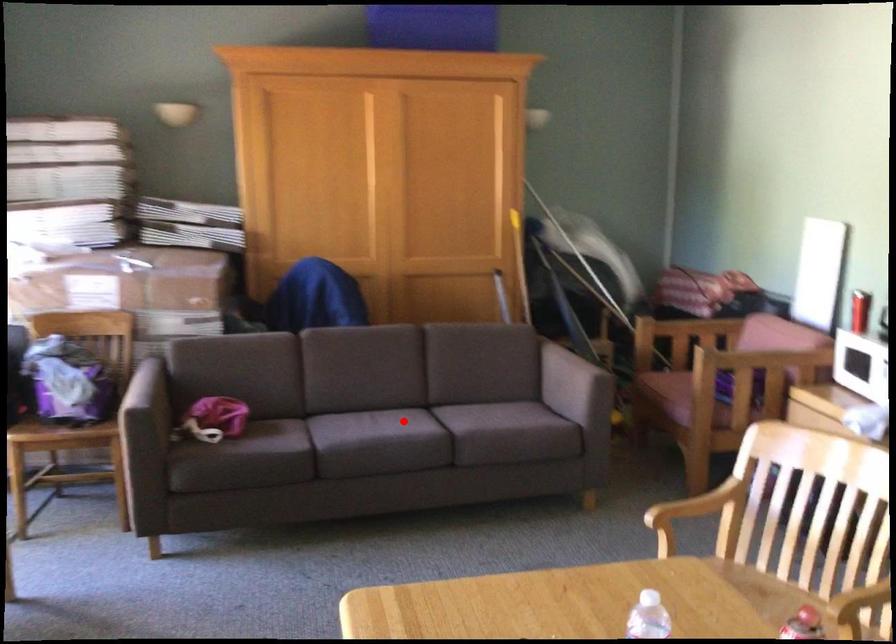
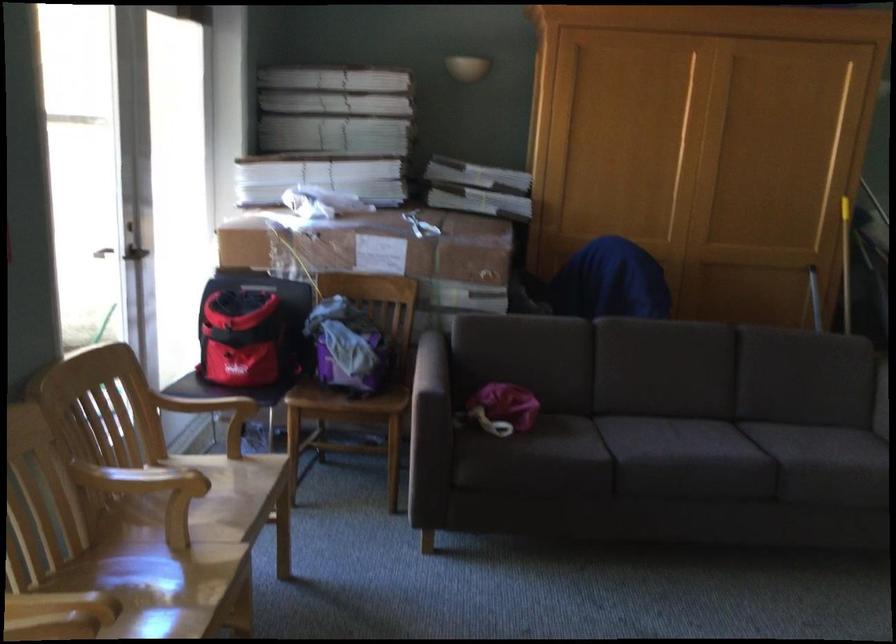
Question: A red point is marked in image1. In image2, is the corresponding 3D point closer to the camera or farther? Reply with the corresponding letter.

Choices:
 (A) The corresponding 3D point is closer.
 (B) The corresponding 3D point is farther.

Answer: (A)